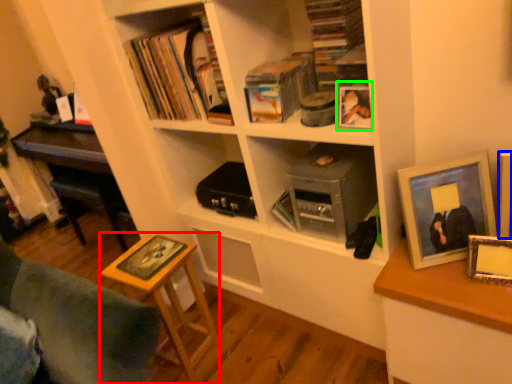
Question: Based on their relative distances, which object is farther from table (highlighted by a red box)? Choose from picture frame (highlighted by a blue box) and picture frame (highlighted by a green box).

Choices:
 (A) picture frame
 (B) picture frame

Answer: (A)